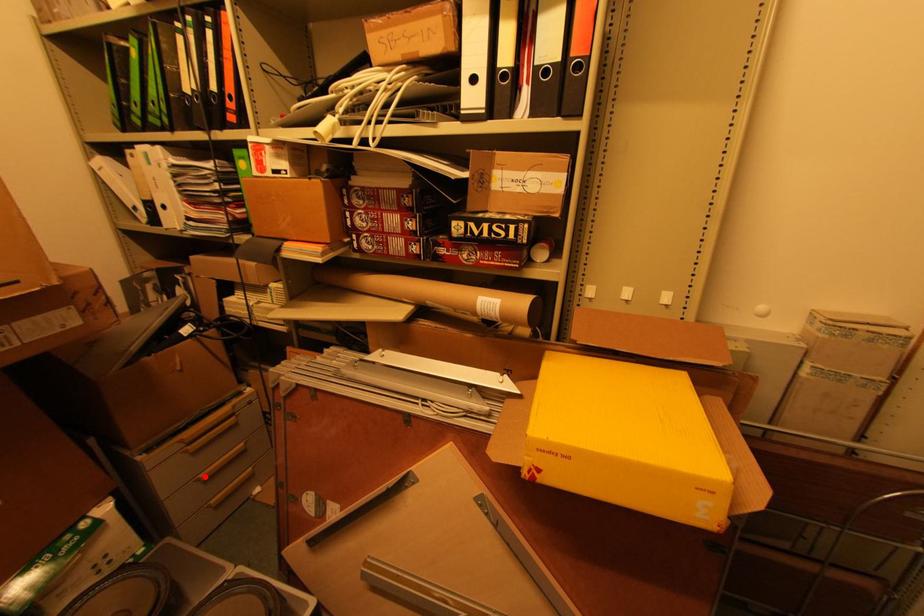
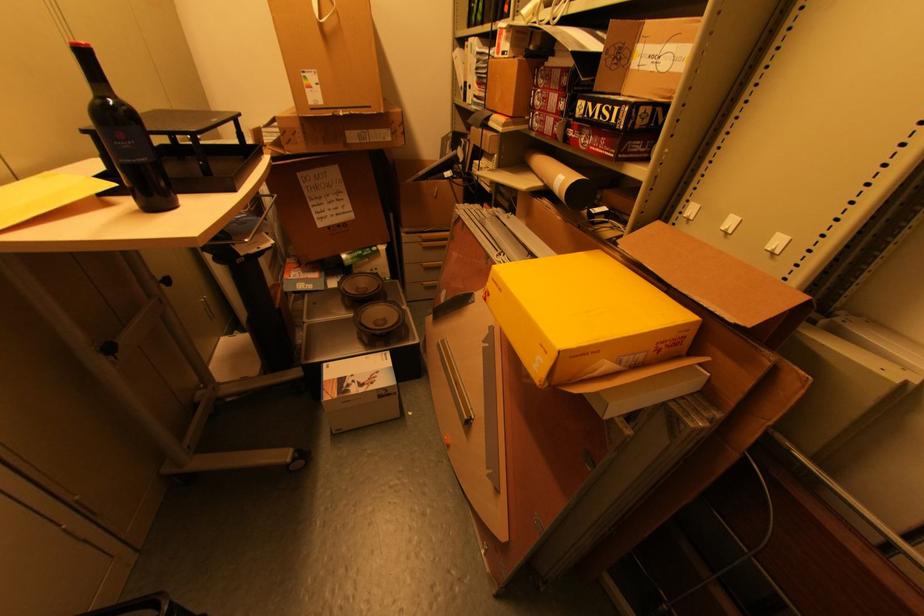
The point at the highlighted location is marked in the first image. Where is the corresponding point in the second image?

(428, 265)